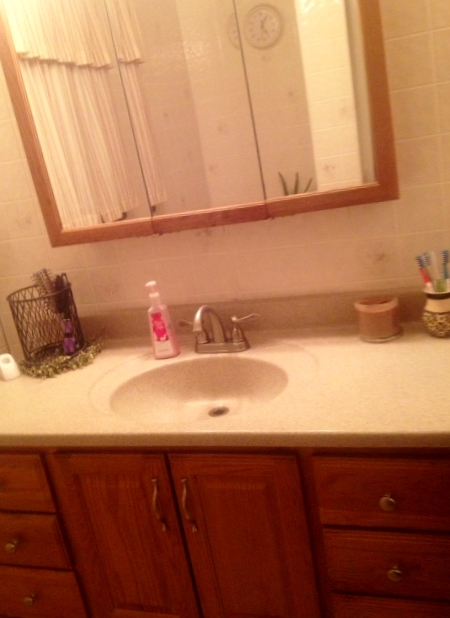
The height and width of the screenshot is (618, 450). What are the coordinates of `black wire storage basket` in the screenshot? It's located at (24, 326).